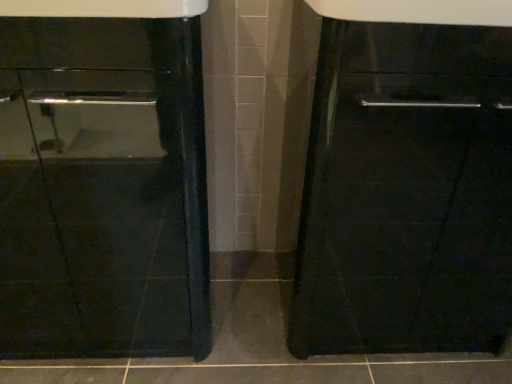
Question: In terms of width, does glossy black cabinet at right look wider or thinner when compared to glossy black sink at center?

Choices:
 (A) wide
 (B) thin

Answer: (B)

Question: Based on their positions, is glossy black cabinet at right located to the left or right of glossy black sink at center?

Choices:
 (A) left
 (B) right

Answer: (B)

Question: From a real-world perspective, is glossy black cabinet at right above or below glossy black sink at center?

Choices:
 (A) above
 (B) below

Answer: (A)

Question: In terms of size, does glossy black sink at center appear bigger or smaller than glossy black cabinet at right?

Choices:
 (A) small
 (B) big

Answer: (B)

Question: In terms of height, does glossy black sink at center look taller or shorter compared to glossy black cabinet at right?

Choices:
 (A) short
 (B) tall

Answer: (B)

Question: Considering the positions of glossy black sink at center and glossy black cabinet at right in the image, is glossy black sink at center wider or thinner than glossy black cabinet at right?

Choices:
 (A) wide
 (B) thin

Answer: (A)

Question: From the image's perspective, relative to glossy black cabinet at right, is glossy black sink at center above or below?

Choices:
 (A) above
 (B) below

Answer: (B)